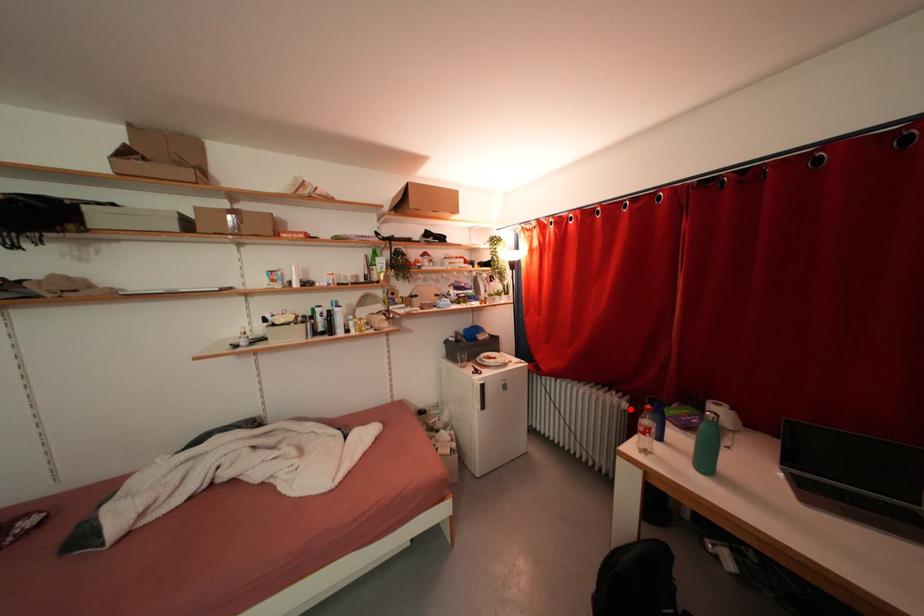
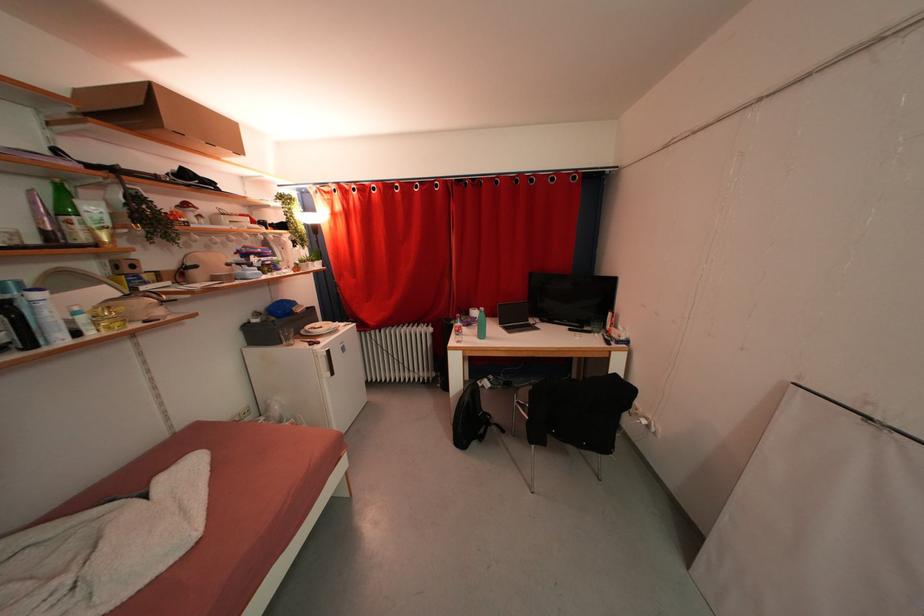
Question: I am providing you with two images of the same scene from different viewpoints. Image1 has a red point marked. In image2, the corresponding 3D location appears at what relative position? Reply with the corresponding letter.

Choices:
 (A) Closer
 (B) Farther

Answer: (B)